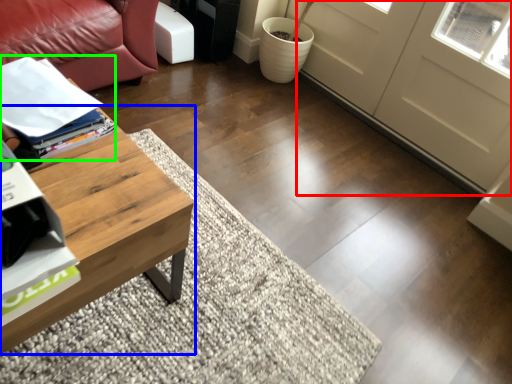
Question: Based on their relative distances, which object is nearer to screen door (highlighted by a red box)? Choose from coffee table (highlighted by a blue box) and magazine (highlighted by a green box).

Choices:
 (A) coffee table
 (B) magazine

Answer: (B)